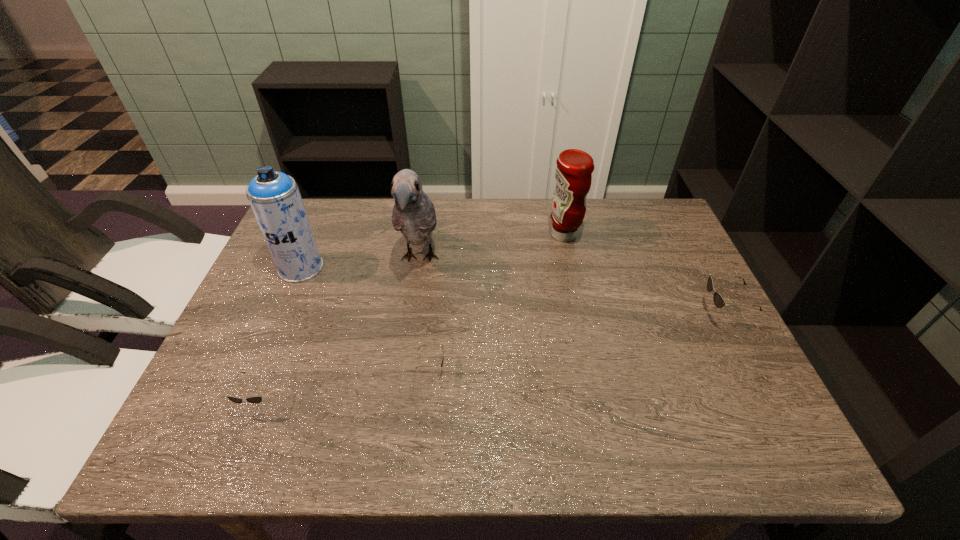
Where is `free spot located 0.370m in front of the lenses of the shortest sunglasses`? The width and height of the screenshot is (960, 540). free spot located 0.370m in front of the lenses of the shortest sunglasses is located at coordinates (612, 369).

Find the location of `vacant area situated in front of the lenses of the tallest sunglasses`. vacant area situated in front of the lenses of the tallest sunglasses is located at coordinates (607, 315).

Where is `vacant space located 0.240m in front of the lenses of the tallest sunglasses`? The image size is (960, 540). vacant space located 0.240m in front of the lenses of the tallest sunglasses is located at coordinates tap(603, 315).

Image resolution: width=960 pixels, height=540 pixels. In order to click on vacant space situated 0.350m in front of the lenses of the tallest sunglasses in this screenshot , I will do `click(559, 315)`.

I want to click on blank area located 0.080m on the back of the third tallest object, so click(x=558, y=207).

Identify the location of vacant space located 0.050m on the front-facing side of the parrot. (412, 307).

Find the location of `free region located 0.060m on the back of the aerosol can`. free region located 0.060m on the back of the aerosol can is located at coordinates (313, 240).

Identify the location of condiment at the far edge. (573, 176).

The height and width of the screenshot is (540, 960). Identify the location of parrot at the far edge. pos(414,215).

In order to click on sunglasses at the left edge in this screenshot , I will do `click(253, 399)`.